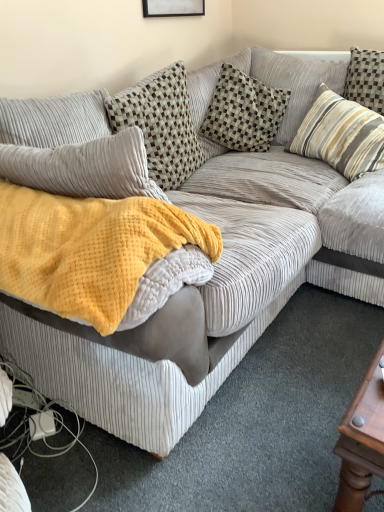
Question: Is yellow waffle knit blanket at center smaller than checkered fabric pillow at center, placed as the 2th pillow when sorted from left to right?

Choices:
 (A) no
 (B) yes

Answer: (A)

Question: Is checkered fabric pillow at center, the second pillow in the right-to-left sequence, at the back of yellow waffle knit blanket at center?

Choices:
 (A) yes
 (B) no

Answer: (B)

Question: From the image's perspective, would you say yellow waffle knit blanket at center is positioned over checkered fabric pillow at center, placed as the 2th pillow when sorted from left to right?

Choices:
 (A) no
 (B) yes

Answer: (A)

Question: From a real-world perspective, is yellow waffle knit blanket at center physically above checkered fabric pillow at center, placed as the 2th pillow when sorted from left to right?

Choices:
 (A) yes
 (B) no

Answer: (A)

Question: Is yellow waffle knit blanket at center wider than checkered fabric pillow at center, the second pillow in the right-to-left sequence?

Choices:
 (A) no
 (B) yes

Answer: (B)

Question: Would you say checkered fabric pillow at upper left, marked as the first pillow in a left-to-right arrangement, is to the left or to the right of striped fabric pillow at upper right, the third pillow in the left-to-right sequence, in the picture?

Choices:
 (A) right
 (B) left

Answer: (B)

Question: Considering the positions of checkered fabric pillow at upper left, positioned as the 3th pillow in right-to-left order, and striped fabric pillow at upper right, which is counted as the 1th pillow, starting from the right, in the image, is checkered fabric pillow at upper left, positioned as the 3th pillow in right-to-left order, taller or shorter than striped fabric pillow at upper right, which is counted as the 1th pillow, starting from the right,?

Choices:
 (A) tall
 (B) short

Answer: (A)

Question: In terms of width, does checkered fabric pillow at upper left, marked as the first pillow in a left-to-right arrangement, look wider or thinner when compared to striped fabric pillow at upper right, which is counted as the 1th pillow, starting from the right?

Choices:
 (A) wide
 (B) thin

Answer: (B)

Question: In the image, is checkered fabric pillow at upper left, positioned as the 3th pillow in right-to-left order, positioned in front of or behind striped fabric pillow at upper right, which is counted as the 1th pillow, starting from the right?

Choices:
 (A) behind
 (B) front

Answer: (B)

Question: Is yellow waffle knit blanket at center in front of or behind checkered fabric pillow at center, the second pillow in the right-to-left sequence, in the image?

Choices:
 (A) behind
 (B) front

Answer: (B)

Question: From a real-world perspective, is yellow waffle knit blanket at center positioned above or below checkered fabric pillow at center, the second pillow in the right-to-left sequence?

Choices:
 (A) below
 (B) above

Answer: (B)

Question: Is yellow waffle knit blanket at center inside or outside of checkered fabric pillow at center, placed as the 2th pillow when sorted from left to right?

Choices:
 (A) outside
 (B) inside

Answer: (A)

Question: Considering the positions of point (49, 307) and point (221, 108), is point (49, 307) closer or farther from the camera than point (221, 108)?

Choices:
 (A) farther
 (B) closer

Answer: (B)

Question: Is striped fabric pillow at upper right, the third pillow in the left-to-right sequence, bigger or smaller than yellow waffle knit blanket at center?

Choices:
 (A) big
 (B) small

Answer: (B)

Question: Is striped fabric pillow at upper right, which is counted as the 1th pillow, starting from the right, in front of or behind yellow waffle knit blanket at center in the image?

Choices:
 (A) behind
 (B) front

Answer: (A)